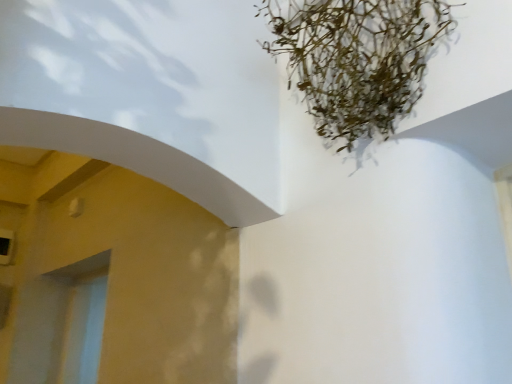
The image size is (512, 384). Find the location of `green leafy plant at upper center`. green leafy plant at upper center is located at coordinates (357, 61).

The height and width of the screenshot is (384, 512). Describe the element at coordinates (357, 61) in the screenshot. I see `green leafy plant at upper center` at that location.

Identify the location of green leafy plant at upper center. This screenshot has width=512, height=384. (357, 61).